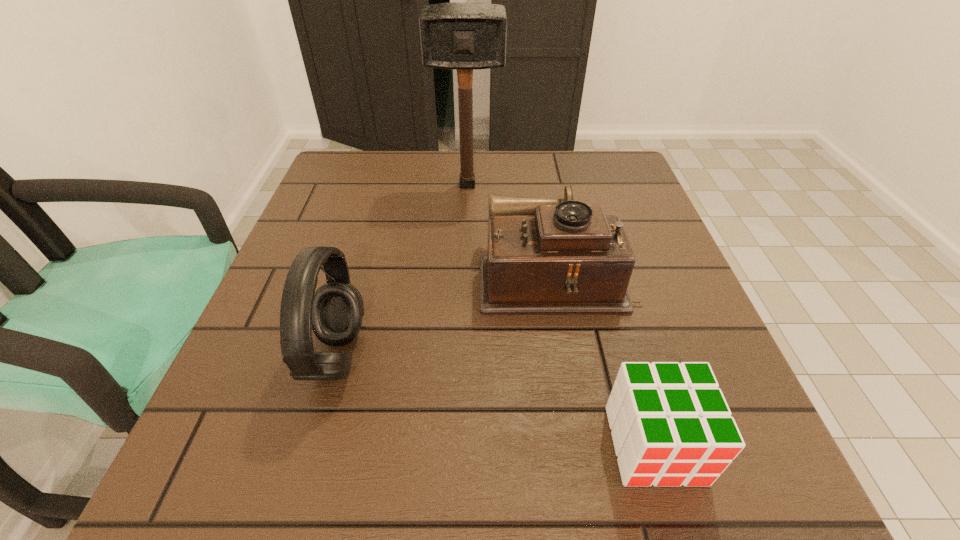
The image size is (960, 540). Find the location of `vacant space located on the horn of the phonograph_record`. vacant space located on the horn of the phonograph_record is located at coordinates tap(378, 274).

Locate an element on the screen. The height and width of the screenshot is (540, 960). object present at the far edge is located at coordinates (456, 36).

Find the location of a particular element. This screenshot has height=540, width=960. object that is at the near edge is located at coordinates (671, 425).

Where is `object that is at the left edge`? object that is at the left edge is located at coordinates (335, 311).

Where is `phonograph_record present at the right edge`? The image size is (960, 540). phonograph_record present at the right edge is located at coordinates (545, 256).

Locate an element on the screen. The width and height of the screenshot is (960, 540). cube that is at the right edge is located at coordinates (671, 425).

Locate an element on the screen. This screenshot has height=540, width=960. object that is at the near right corner is located at coordinates (671, 425).

I want to click on vacant space at the far edge of the desktop, so click(449, 152).

In the image, there is a desktop. Where is `free space at the near edge`? free space at the near edge is located at coordinates (634, 490).

You are a GUI agent. You are given a task and a screenshot of the screen. Output one action in this format:
    pyautogui.click(x=<x>, y=<y>)
    Task: Click on the free space at the left edge of the desktop
    Image resolution: width=960 pixels, height=540 pixels.
    Given the screenshot: What is the action you would take?
    pyautogui.click(x=332, y=222)